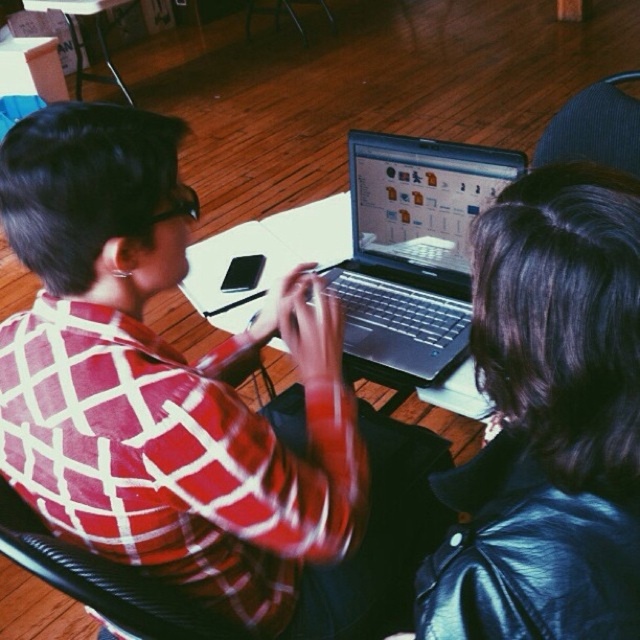
Is plaid fabric chair at center further to camera compared to blue fabric chair at upper right?

No.

Does plaid fabric chair at center have a larger size compared to blue fabric chair at upper right?

No, plaid fabric chair at center is not bigger than blue fabric chair at upper right.

This screenshot has height=640, width=640. What are the coordinates of `plaid fabric chair at center` in the screenshot? It's located at (106, 580).

Can you confirm if black leather jacket at center is bigger than plaid fabric chair at center?

Actually, black leather jacket at center might be smaller than plaid fabric chair at center.

Who is positioned more to the left, black leather jacket at center or plaid fabric chair at center?

Positioned to the left is plaid fabric chair at center.

Describe the element at coordinates (548, 420) in the screenshot. The width and height of the screenshot is (640, 640). I see `black leather jacket at center` at that location.

Identify the location of black leather jacket at center. (548, 420).

Between satin silver laptop at center and blue fabric chair at upper right, which one is positioned higher?

blue fabric chair at upper right

Locate an element on the screen. The image size is (640, 640). satin silver laptop at center is located at coordinates (412, 252).